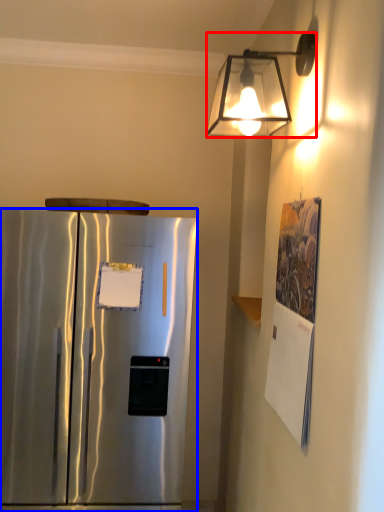
Question: Among these objects, which one is nearest to the camera, lamp (highlighted by a red box) or refrigerator (highlighted by a blue box)?

Choices:
 (A) lamp
 (B) refrigerator

Answer: (A)